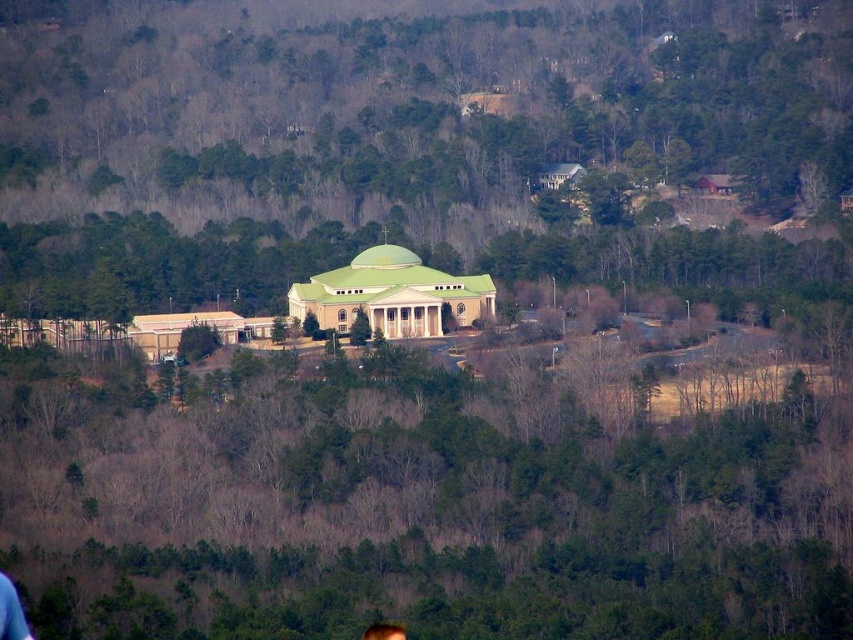
Question: Which point is farther to the camera?

Choices:
 (A) green dome building at center
 (B) green leafy tree at center

Answer: (A)

Question: Can you confirm if green dome building at center is smaller than green leafy tree at center?

Choices:
 (A) yes
 (B) no

Answer: (B)

Question: Can you confirm if green leafy tree at center is positioned to the left of blonde hair at center?

Choices:
 (A) yes
 (B) no

Answer: (B)

Question: Can you confirm if green dome building at center is positioned to the left of green leafy tree at center?

Choices:
 (A) no
 (B) yes

Answer: (A)

Question: Among these points, which one is farthest from the camera?

Choices:
 (A) (369, 627)
 (B) (730, 362)

Answer: (B)

Question: Which object is closer to the camera taking this photo?

Choices:
 (A) green dome building at center
 (B) blonde hair at center

Answer: (A)